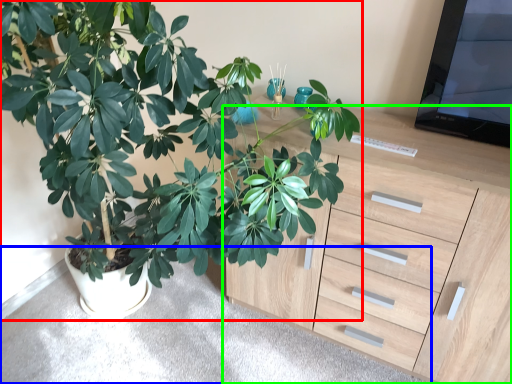
Question: Which object is positioned closest to houseplant (highlighted by a red box)? Select from gray (highlighted by a blue box) and chest of drawers (highlighted by a green box).

Choices:
 (A) gray
 (B) chest of drawers

Answer: (B)